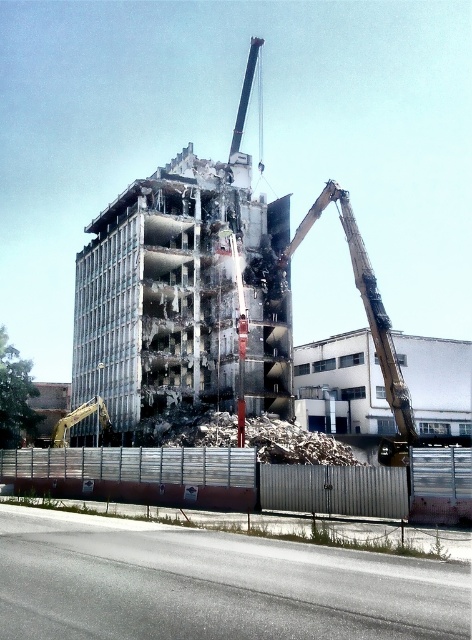
Based on the photo, can you confirm if rubble concrete building at center is positioned to the right of metallic arm at upper right?

No, rubble concrete building at center is not to the right of metallic arm at upper right.

What are the coordinates of `rubble concrete building at center` in the screenshot? It's located at (183, 296).

Where is `rubble concrete building at center`? This screenshot has height=640, width=472. rubble concrete building at center is located at coordinates (183, 296).